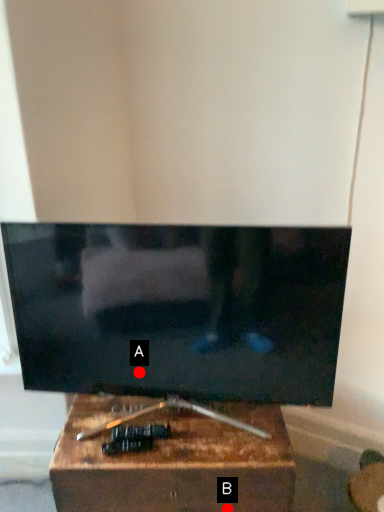
Question: Two points are circled on the image, labeled by A and B beside each circle. Which of the following is the farthest from the observer?

Choices:
 (A) A is further
 (B) B is further

Answer: (A)